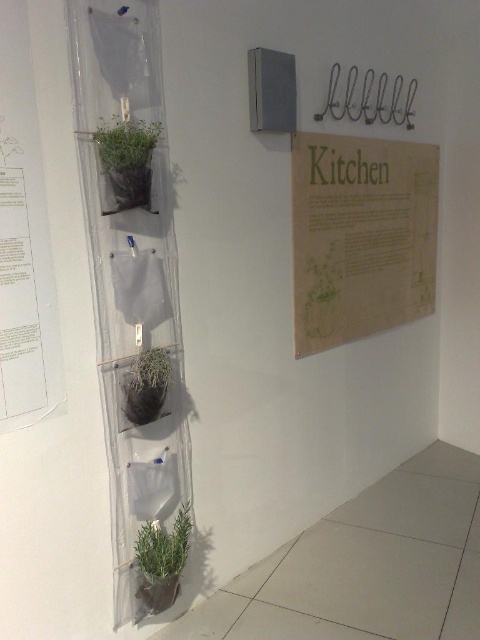
Question: Is burlap paper sign at upper right above green matte plant at center?

Choices:
 (A) no
 (B) yes

Answer: (B)

Question: Which object is farther from the camera taking this photo?

Choices:
 (A) green matte plant at center
 (B) green fabric plant at upper center

Answer: (A)

Question: Which point is closer to the camera?

Choices:
 (A) green matte plant at center
 (B) burlap paper sign at upper right
 (C) green matte plant at lower center
 (D) green fabric plant at upper center

Answer: (D)

Question: Is burlap paper sign at upper right above green fabric plant at upper center?

Choices:
 (A) yes
 (B) no

Answer: (B)

Question: Among these points, which one is nearest to the camera?

Choices:
 (A) (403, 163)
 (B) (123, 132)
 (C) (151, 529)

Answer: (B)

Question: Can you confirm if burlap paper sign at upper right is smaller than green matte plant at center?

Choices:
 (A) no
 (B) yes

Answer: (A)